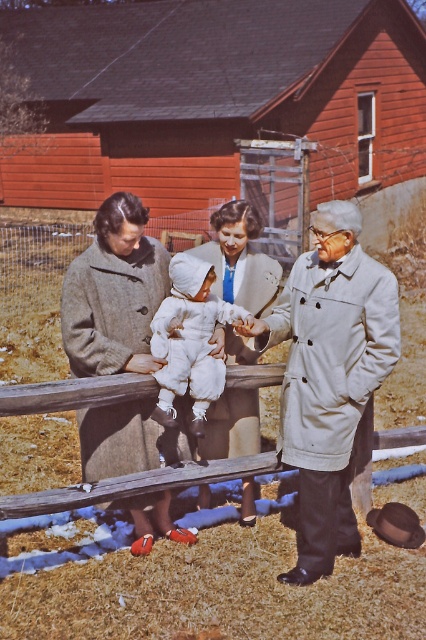
Based on the scene description, can you determine which clothing item is closer to the viewer between the white woolen suit at center and the white fluffy snowsuit at center?

The white woolen suit at center is positioned under the white fluffy snowsuit at center, so the white fluffy snowsuit at center is closer to the viewer.

You are a tailor observing the scene. You need to determine which coat requires more fabric to make between the light beige trench coat at center and the cozy wool coat at center. Based on the description, which one would need more fabric?

The light beige trench coat at center is larger in size than the cozy wool coat at center, so it would require more fabric to make.

You are a tailor observing the vintage scene. You need to determine which garment requires more fabric for a custom order. The scene shows a white woolen suit at center and a cozy wool coat at center. Which one might need more fabric based on their sizes?

The white woolen suit at center might be wider than cozy wool coat at center, so it likely requires more fabric for the custom order.